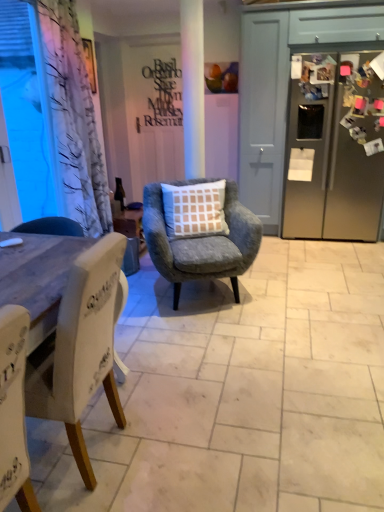
Question: Is transparent plastic window screen at left at the left side of velvet grey armchair with checkered cushion at center, the second chair in the left-to-right sequence?

Choices:
 (A) no
 (B) yes

Answer: (B)

Question: Could velvet grey armchair with checkered cushion at center, the 1th chair when ordered from back to front, be considered to be inside transparent plastic window screen at left?

Choices:
 (A) yes
 (B) no

Answer: (B)

Question: Are transparent plastic window screen at left and velvet grey armchair with checkered cushion at center, the second chair in the left-to-right sequence, far apart?

Choices:
 (A) no
 (B) yes

Answer: (B)

Question: Does transparent plastic window screen at left have a lesser width compared to velvet grey armchair with checkered cushion at center, the first chair viewed from the right?

Choices:
 (A) no
 (B) yes

Answer: (B)

Question: Could you tell me if transparent plastic window screen at left is facing velvet grey armchair with checkered cushion at center, the second chair in the left-to-right sequence?

Choices:
 (A) yes
 (B) no

Answer: (A)

Question: From a real-world perspective, is transparent plastic window screen at left beneath velvet grey armchair with checkered cushion at center, the second chair in the left-to-right sequence?

Choices:
 (A) no
 (B) yes

Answer: (A)

Question: Does transparent plastic window screen at left appear on the left side of white matte door at center?

Choices:
 (A) yes
 (B) no

Answer: (A)

Question: Considering the relative positions of transparent plastic window screen at left and white matte door at center in the image provided, is transparent plastic window screen at left to the right of white matte door at center from the viewer's perspective?

Choices:
 (A) no
 (B) yes

Answer: (A)

Question: Does transparent plastic window screen at left have a greater width compared to white matte door at center?

Choices:
 (A) no
 (B) yes

Answer: (A)

Question: From the image's perspective, is transparent plastic window screen at left beneath white matte door at center?

Choices:
 (A) no
 (B) yes

Answer: (B)

Question: Is transparent plastic window screen at left placed right next to white matte door at center?

Choices:
 (A) yes
 (B) no

Answer: (B)

Question: Is transparent plastic window screen at left oriented away from white matte door at center?

Choices:
 (A) no
 (B) yes

Answer: (A)

Question: Considering the relative sizes of white matte door at center and white fabric chair at left, which ranks as the second chair in right-to-left order, in the image provided, is white matte door at center wider than white fabric chair at left, which ranks as the second chair in right-to-left order,?

Choices:
 (A) no
 (B) yes

Answer: (B)